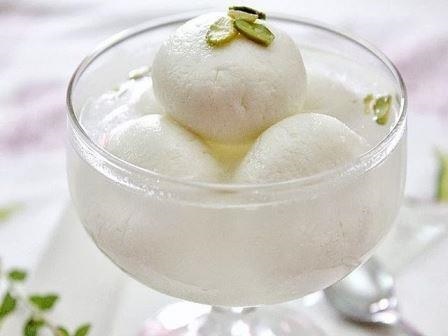
Where is `tip of spoon`? This screenshot has height=336, width=448. tip of spoon is located at coordinates (364, 292).